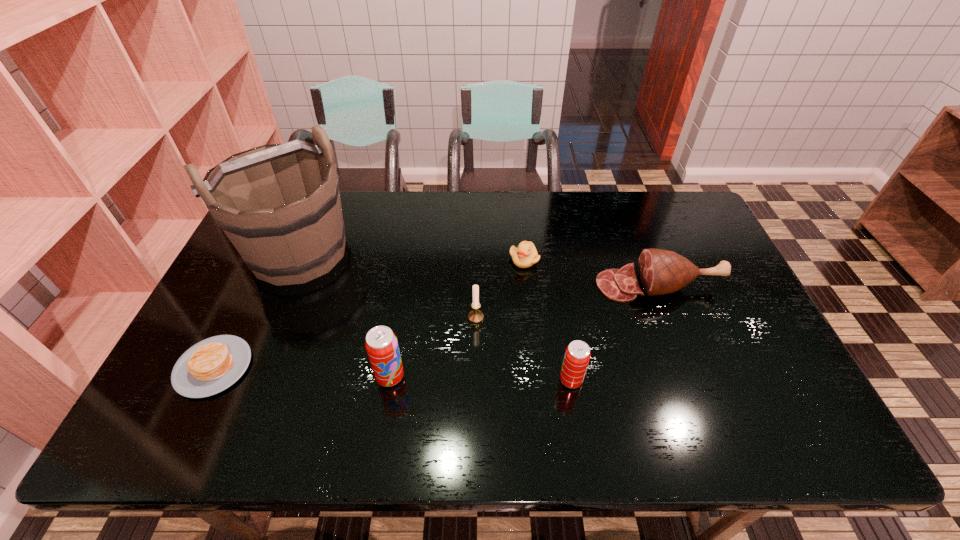
The height and width of the screenshot is (540, 960). I want to click on free space between the fifth object from left to right and the ham, so click(x=591, y=273).

Locate an element on the screen. This screenshot has height=540, width=960. object that ranks as the fourth closest to the ham is located at coordinates (381, 344).

Find the location of a particular element. The height and width of the screenshot is (540, 960). object that ranks as the second closest to the left soda can is located at coordinates (279, 204).